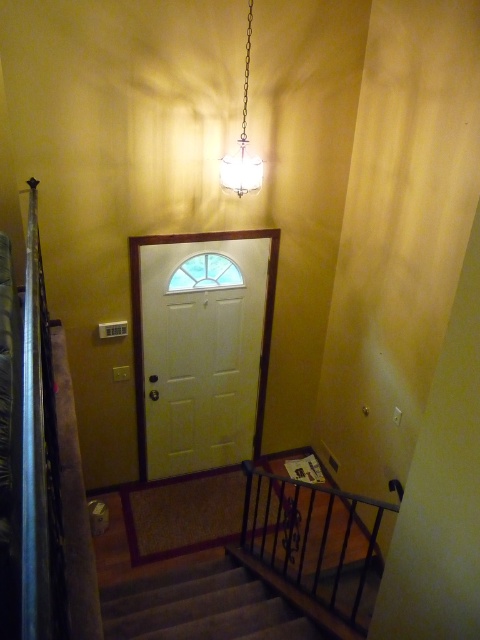
Looking at this image, who is positioned more to the right, carpeted stairs at center or white glass chandelier at upper center?

white glass chandelier at upper center

Which is in front, point (192, 579) or point (244, 70)?

Positioned in front is point (244, 70).

I want to click on carpeted stairs at center, so click(201, 605).

Is white matte door at center bigger than black metal balustrade at lower right?

Indeed, white matte door at center has a larger size compared to black metal balustrade at lower right.

Which is behind, point (245, 339) or point (331, 576)?

The point (245, 339) is more distant.

Describe the element at coordinates (202, 348) in the screenshot. This screenshot has height=640, width=480. I see `white matte door at center` at that location.

Locate an element on the screen. white matte door at center is located at coordinates (202, 348).

Between black metal balustrade at lower right and carpeted stairs at center, which one has less height?

Standing shorter between the two is carpeted stairs at center.

Which is in front, point (365, 504) or point (214, 577)?

Point (214, 577) is in front.

At what (x,y) coordinates should I click in order to perform the action: click on black metal balustrade at lower right. Please return your answer as a coordinate pair (x, y). Looking at the image, I should click on (315, 547).